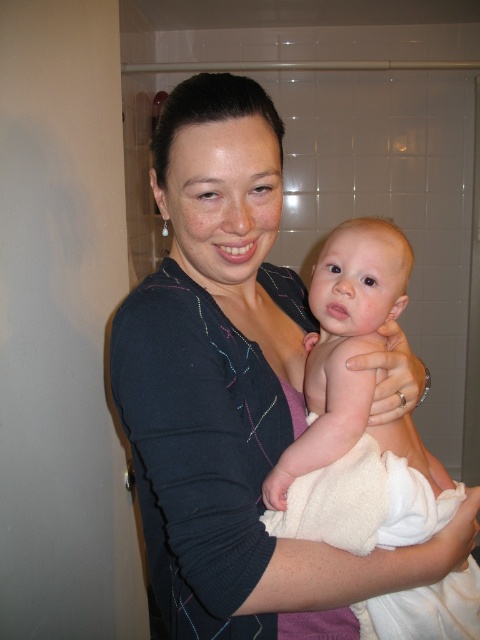
You are designing a layout for a photo shoot and need to ensure that the matte black sweater at center and the white towel wrapped baby at center fit within a rectangular frame. The frame has a maximum width capacity. Which object should be placed first to ensure both fit without exceeding the frame width?

The white towel wrapped baby at center should be placed first since the matte black sweater at center is wider. By placing the narrower object first, there will be enough space left for the wider sweater.

You are a photographer trying to capture a candid shot of the baby in the scene. You notice the matte black sweater at center and the white towel wrapped baby at center. Which object is positioned higher in the image?

The matte black sweater at center is above the white towel wrapped baby at center, so the sweater is positioned higher in the image.

You are standing in the bathroom and see two points marked in the scene. Which point is closer to you, point [279,362] or point [319,380]?

Point [319,380] is closer to you because it is in front of point [279,362] according to their spatial relationship.